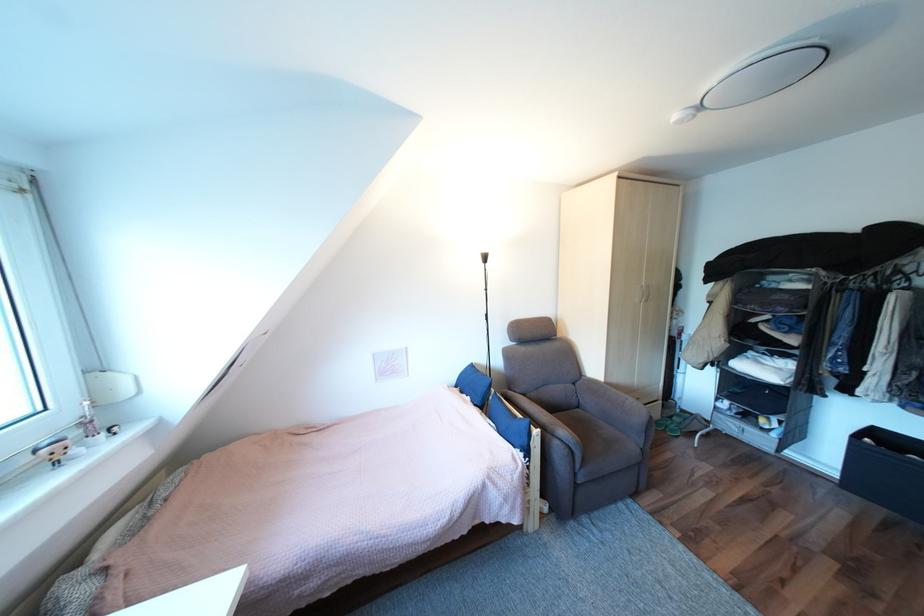
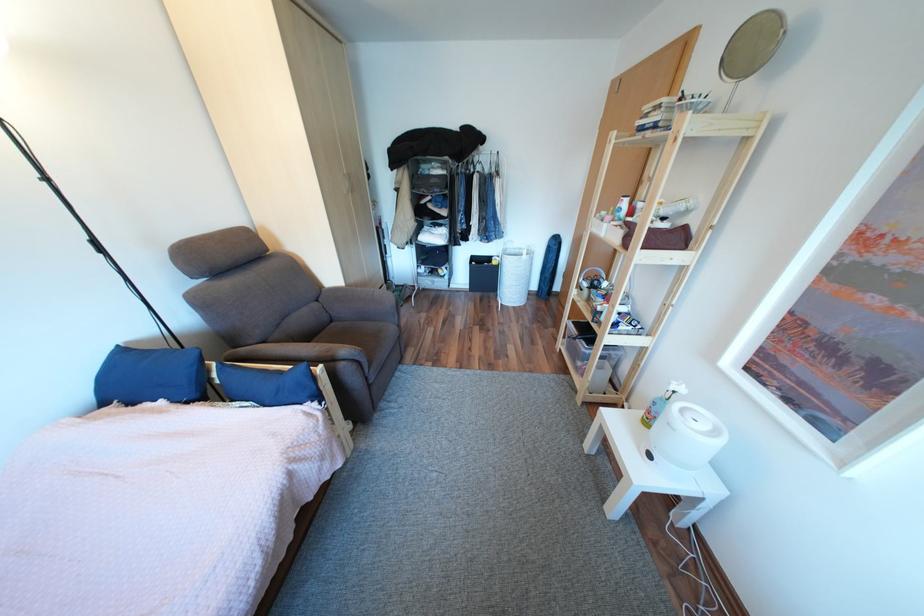
In the second image, find the point that corresponds to (x=490, y=403) in the first image.

(205, 395)